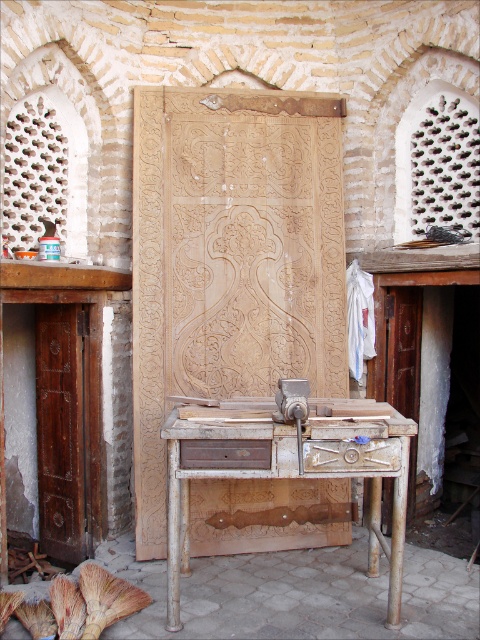
Question: Which object is closer to the camera taking this photo?

Choices:
 (A) brown wood drawer at center
 (B) brushed wood drawer at center
 (C) rusty metal workbench at center

Answer: (C)

Question: Can you confirm if brushed wood drawer at center is positioned above brown wood drawer at center?

Choices:
 (A) yes
 (B) no

Answer: (B)

Question: Among these objects, which one is farthest from the camera?

Choices:
 (A) brushed wood drawer at center
 (B) brown wood drawer at center
 (C) rusty metal workbench at center

Answer: (A)

Question: Can you confirm if brushed wood drawer at center is positioned to the left of brown wood drawer at center?

Choices:
 (A) no
 (B) yes

Answer: (A)

Question: Is rusty metal workbench at center above brown wood drawer at center?

Choices:
 (A) no
 (B) yes

Answer: (A)

Question: Among these points, which one is farthest from the camera?

Choices:
 (A) (224, 451)
 (B) (348, 451)

Answer: (B)